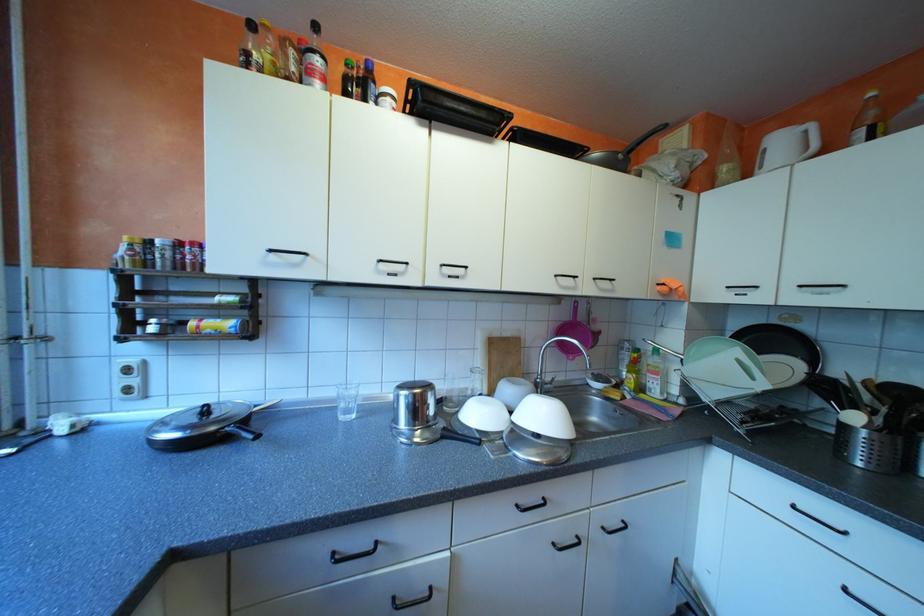
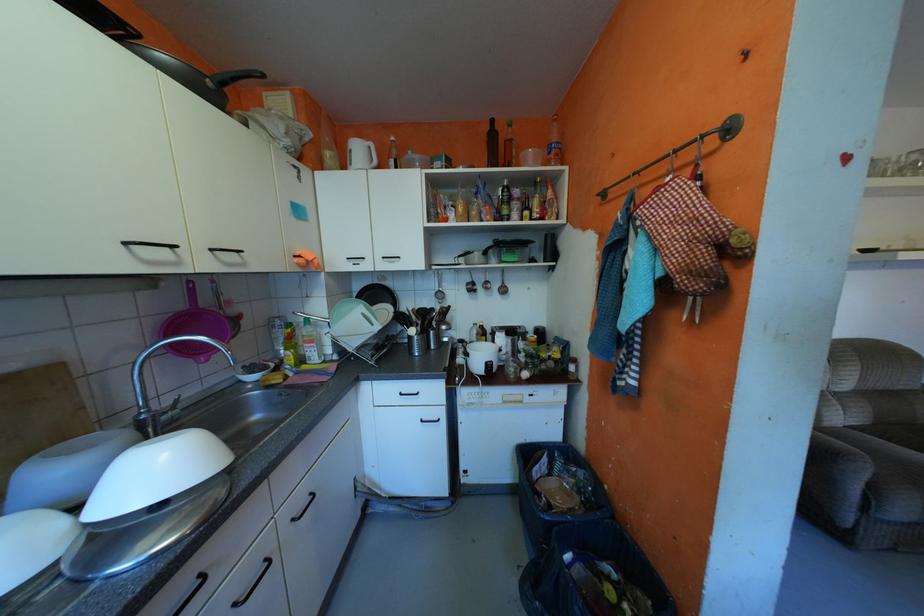
Question: The first image is from the beginning of the video and the second image is from the end. How did the camera likely rotate when shooting the video?

Choices:
 (A) Left
 (B) Right
 (C) Up
 (D) Down

Answer: (B)